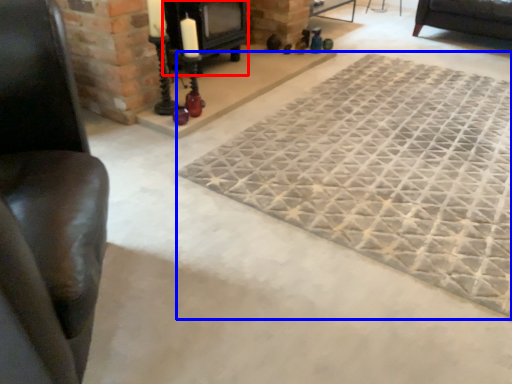
Question: Among these objects, which one is farthest to the camera, fireplace (highlighted by a red box) or mat (highlighted by a blue box)?

Choices:
 (A) fireplace
 (B) mat

Answer: (A)